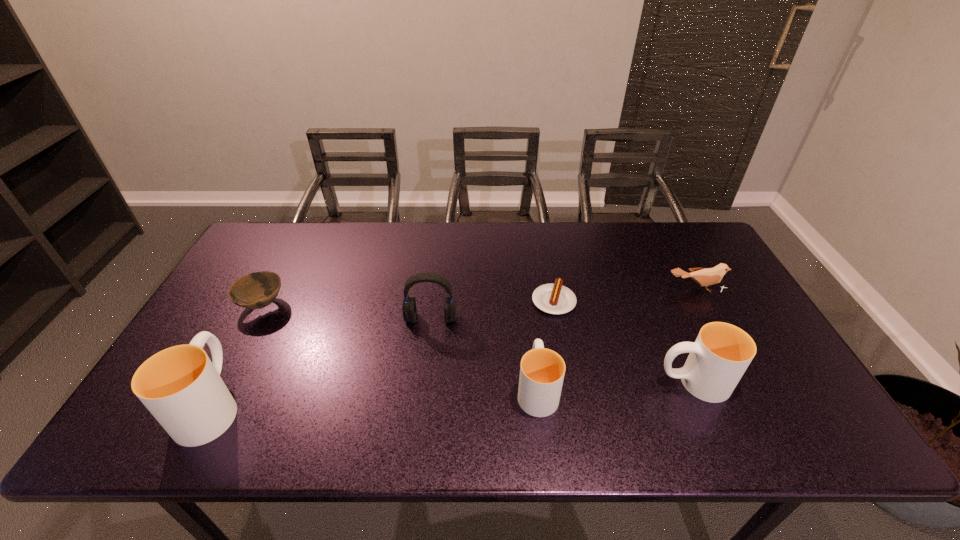
Where is `vacant space in between the third object from left to right and the fourth shortest object`? vacant space in between the third object from left to right and the fourth shortest object is located at coordinates (484, 354).

You are a GUI agent. You are given a task and a screenshot of the screen. Output one action in this format:
    pyautogui.click(x=<x>, y=<y>)
    Task: Click on the empty space between the shortest object and the third object from left to right
    The width and height of the screenshot is (960, 540).
    Given the screenshot: What is the action you would take?
    pyautogui.click(x=492, y=309)

I want to click on free point between the fourth tallest object and the second shortest object, so click(x=400, y=347).

What are the coordinates of `free space between the second cup from right to left and the headset` in the screenshot? It's located at (484, 354).

Where is `free space between the second shortest object and the rightmost cup`? The image size is (960, 540). free space between the second shortest object and the rightmost cup is located at coordinates (478, 343).

Locate an element on the screen. This screenshot has height=540, width=960. empty space that is in between the leftmost cup and the fourth tallest object is located at coordinates (374, 397).

At what (x,y) coordinates should I click in order to perform the action: click on empty space that is in between the fourth tallest object and the bird. Please return your answer as a coordinate pair (x, y). This screenshot has width=960, height=540. Looking at the image, I should click on (616, 339).

You are a GUI agent. You are given a task and a screenshot of the screen. Output one action in this format:
    pyautogui.click(x=<x>, y=<y>)
    Task: Click on the free spot between the leftmost cup and the second cup from right to left
    The height and width of the screenshot is (540, 960).
    Given the screenshot: What is the action you would take?
    pyautogui.click(x=374, y=397)

Locate which object ranks third in proximity to the bird. Please provide its 2D coordinates. Your answer should be formatted as a tuple, i.e. [(x, y)], where the tuple contains the x and y coordinates of a point satisfying the conditions above.

[(542, 370)]

Locate an element on the screen. object that stands as the closest to the rightmost cup is located at coordinates (555, 298).